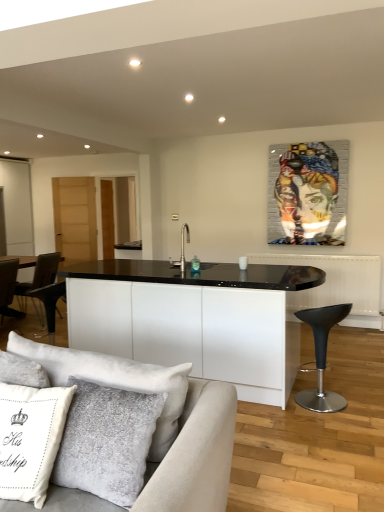
Question: From the image's perspective, relative to black matte sink at center, is metallic mosaic portrait at upper center above or below?

Choices:
 (A) below
 (B) above

Answer: (B)

Question: From a real-world perspective, is metallic mosaic portrait at upper center above or below black matte sink at center?

Choices:
 (A) below
 (B) above

Answer: (B)

Question: Which is farther from the metallic mosaic portrait at upper center?

Choices:
 (A) black matte sink at center
 (B) beige fabric couch at lower left
 (C) transparent glass door at left
 (D) black leather stool at lower right
 (E) white textured pillow at lower left

Answer: (E)

Question: Which object is the farthest from the transparent glass door at left?

Choices:
 (A) metallic mosaic portrait at upper center
 (B) beige fabric couch at lower left
 (C) black leather stool at lower right
 (D) black matte sink at center
 (E) white textured pillow at lower left

Answer: (E)